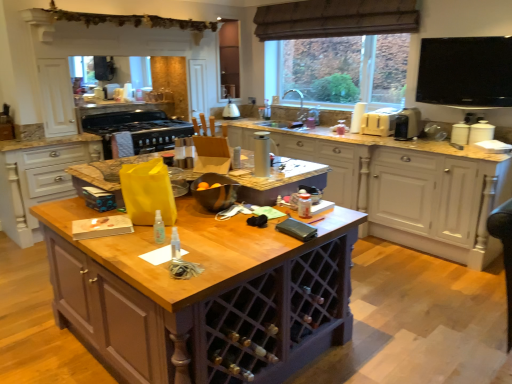
Locate an element on the screen. vacant space in metallic silver toaster at right (from a real-world perspective) is located at coordinates (404, 137).